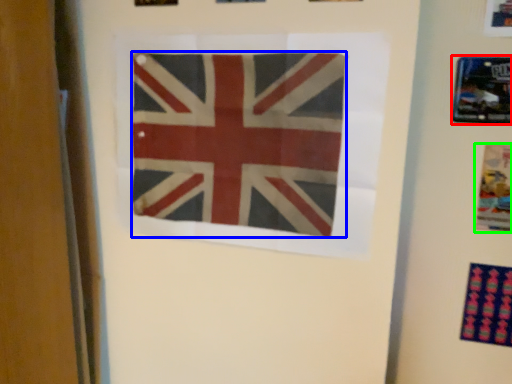
Question: Which object is the closest to the picture frame (highlighted by a red box)? Choose among these: flag (highlighted by a blue box) or poster (highlighted by a green box).

Choices:
 (A) flag
 (B) poster

Answer: (B)